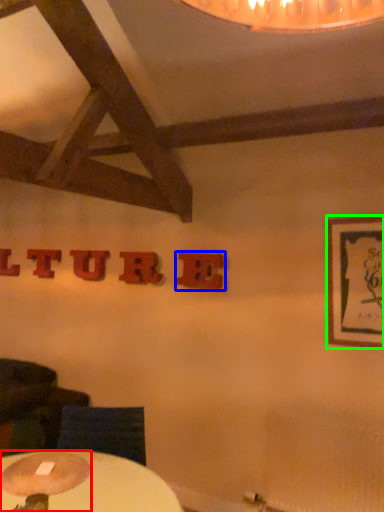
Question: Considering the real-world distances, which object is closest to table lamp (highlighted by a red box)? letter (highlighted by a blue box) or picture frame (highlighted by a green box).

Choices:
 (A) letter
 (B) picture frame

Answer: (A)